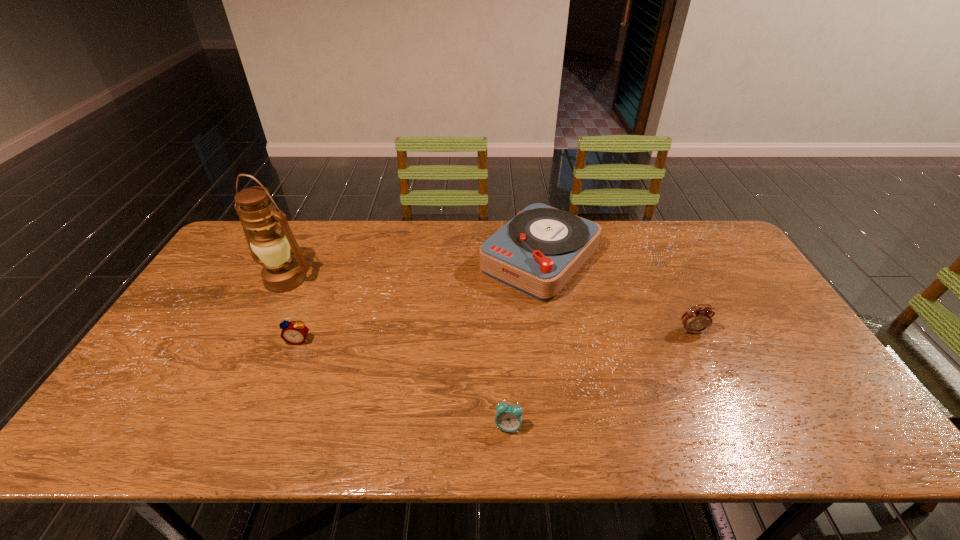
Image resolution: width=960 pixels, height=540 pixels. I want to click on oil lamp, so click(x=270, y=247).

Where is `record player`? This screenshot has width=960, height=540. record player is located at coordinates (537, 252).

The image size is (960, 540). In order to click on the rightmost alarm clock in this screenshot , I will do `click(696, 319)`.

Find the location of a particular element. The height and width of the screenshot is (540, 960). the leftmost alarm clock is located at coordinates (294, 332).

Locate an element on the screen. This screenshot has width=960, height=540. the second alarm clock from right to left is located at coordinates (508, 418).

Locate an element on the screen. The image size is (960, 540). the nearest object is located at coordinates (508, 418).

At what (x,y) coordinates should I click in order to perform the action: click on vacant area situated 0.160m on the back of the oil lamp. Please return your answer as a coordinate pair (x, y). Looking at the image, I should click on (306, 238).

The height and width of the screenshot is (540, 960). Find the location of `vacant space located on the right of the fourth shortest object`. vacant space located on the right of the fourth shortest object is located at coordinates (707, 259).

I want to click on vacant space positioned on the face of the rightmost alarm clock, so click(703, 352).

Locate an element on the screen. This screenshot has height=540, width=960. vacant region located 0.080m on the front-facing side of the leftmost alarm clock is located at coordinates (287, 370).